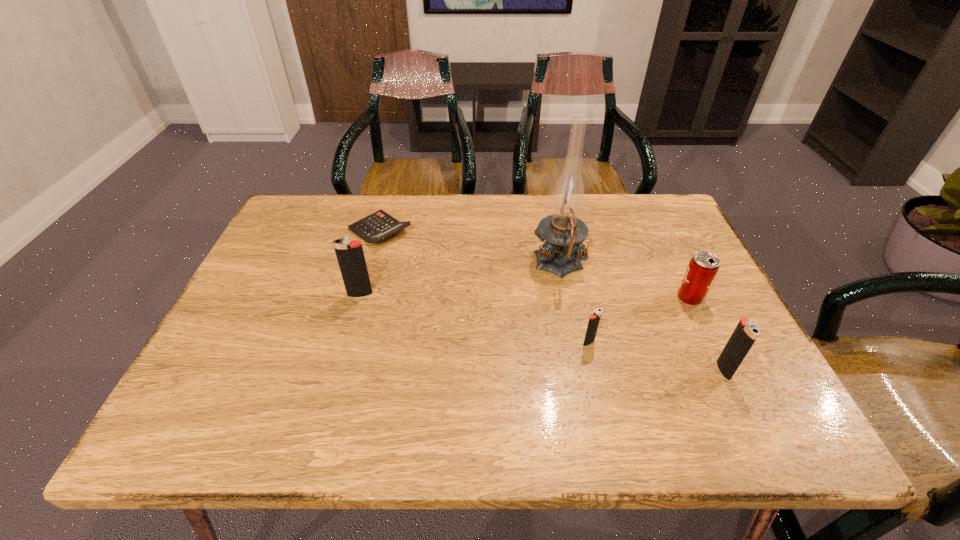
At what (x,y) coordinates should I click in order to perform the action: click on vacant space that satisfies the following two spatial constraints: 1. on the back side of the fourth tallest object; 2. on the right side of the second igniter from right to left. Please return your answer as a coordinate pair (x, y). Looking at the image, I should click on (579, 298).

I want to click on free space in the image that satisfies the following two spatial constraints: 1. on the front side of the oil lamp; 2. on the right side of the second shortest igniter, so click(580, 370).